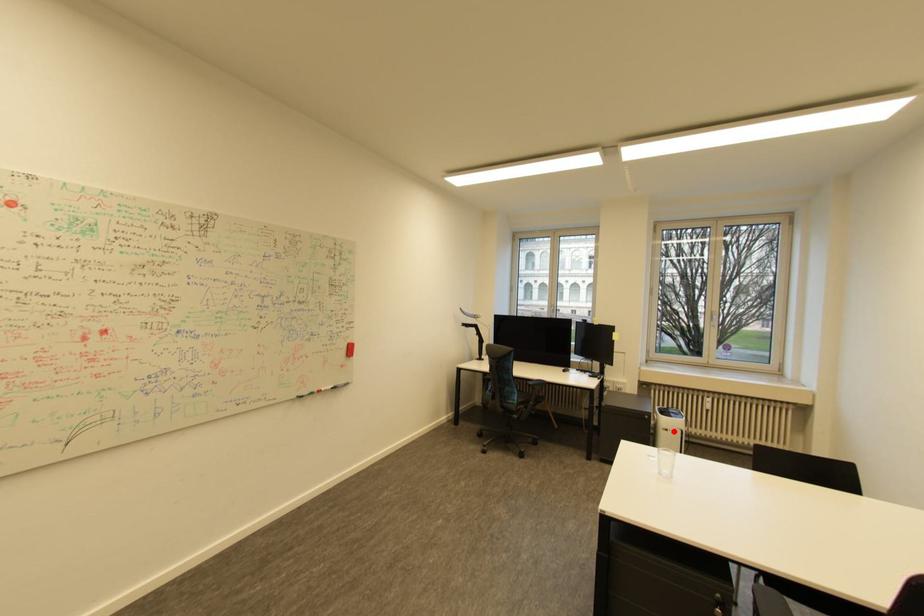
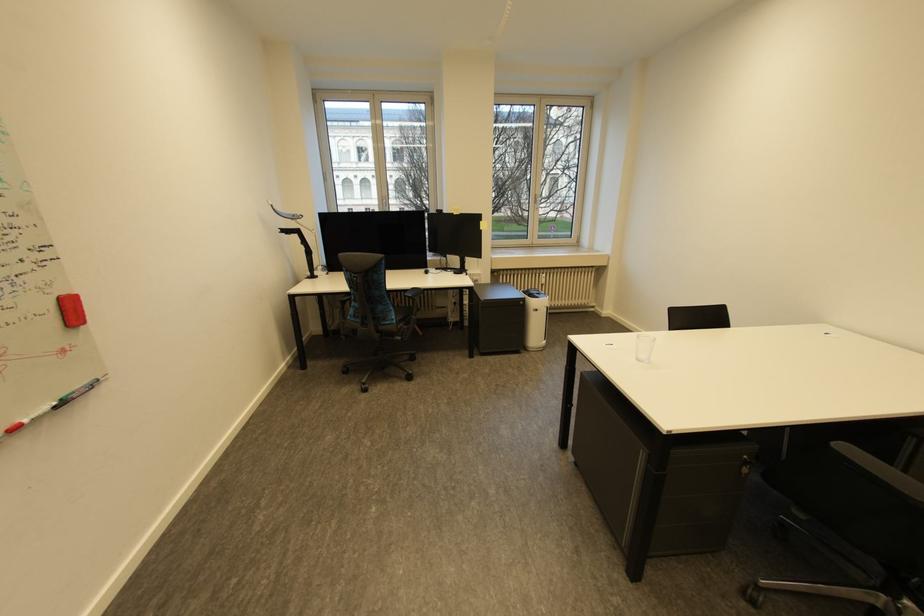
Locate, in the second image, the point that corresponds to the highlighted location in the first image.

(543, 310)